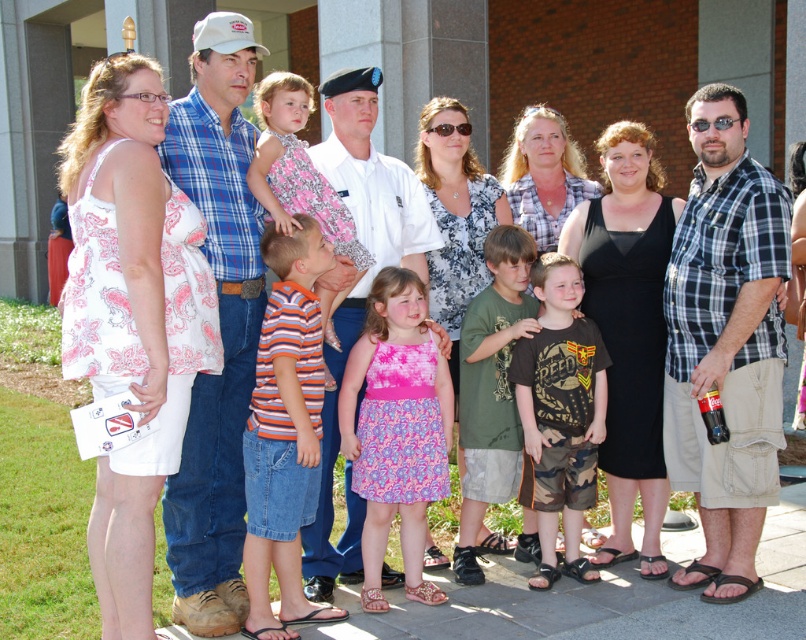
Question: Among these objects, which one is farthest from the camera?

Choices:
 (A) white uniform at center
 (B) pink floral dress at center
 (C) white printed dress at left
 (D) green cotton shirt at center

Answer: (D)

Question: Which point is farther to the camera?

Choices:
 (A) white printed dress at left
 (B) blue plaid shirt at center

Answer: (B)

Question: Which of the following is the closest to the observer?

Choices:
 (A) (672, 310)
 (B) (410, 204)

Answer: (A)

Question: From the image, what is the correct spatial relationship of white printed dress at left in relation to orange striped shirt at center?

Choices:
 (A) below
 (B) above

Answer: (B)

Question: Does plaid shirt at right appear over green cotton shirt at center?

Choices:
 (A) no
 (B) yes

Answer: (B)

Question: From the image, what is the correct spatial relationship of blue plaid shirt at center in relation to camouflage shorts at center?

Choices:
 (A) below
 (B) above

Answer: (B)